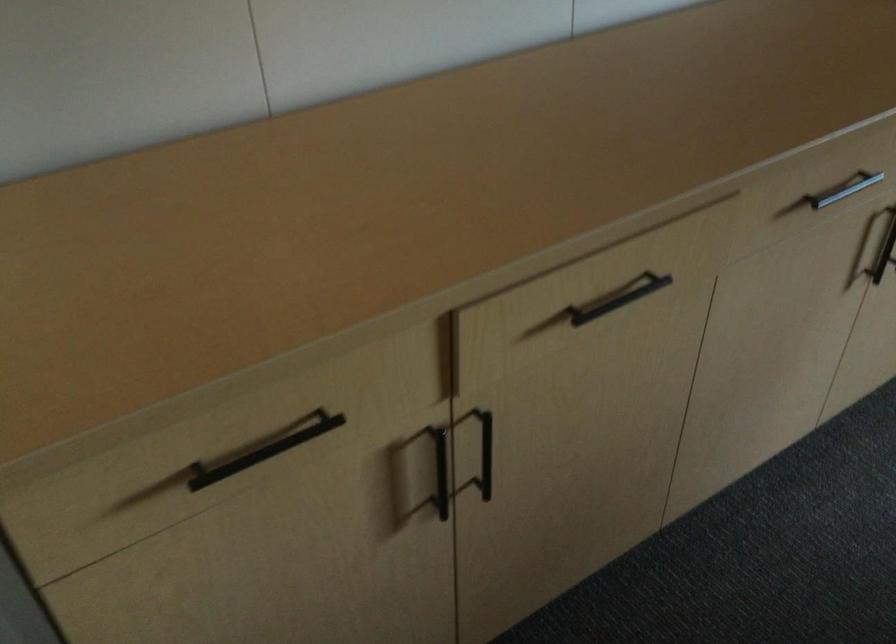
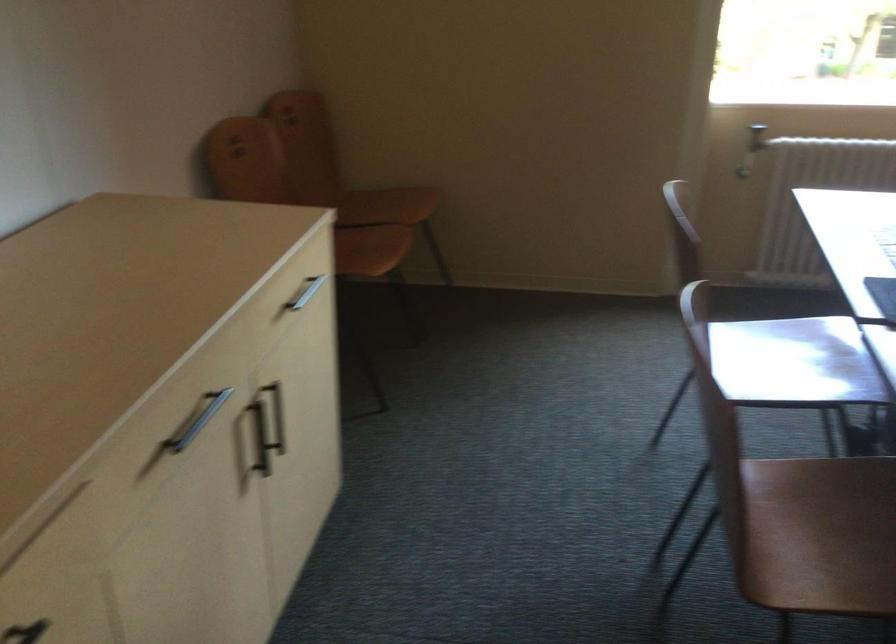
Question: The camera is either moving clockwise (left) or counter-clockwise (right) around the object. The first image is from the beginning of the video and the second image is from the end. Is the camera moving left or right when shooting the video?

Choices:
 (A) Left
 (B) Right

Answer: (A)